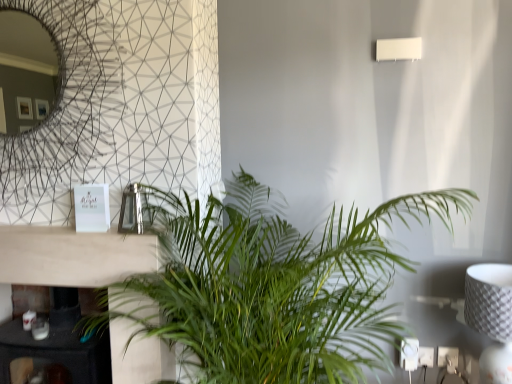
Question: From a real-world perspective, is green leafy plant at center physically located above or below black marble fireplace at lower left?

Choices:
 (A) above
 (B) below

Answer: (A)

Question: Does point coord(178,230) appear closer or farther from the camera than point coord(23,228)?

Choices:
 (A) farther
 (B) closer

Answer: (B)

Question: Considering the real-world distances, which object is farthest from the white matte rectangular lamp at upper right?

Choices:
 (A) black marble fireplace at lower left
 (B) white textured lampshade at right
 (C) green leafy plant at center

Answer: (A)

Question: Which object is the farthest from the white matte rectangular lamp at upper right?

Choices:
 (A) white textured lampshade at right
 (B) green leafy plant at center
 (C) black marble fireplace at lower left

Answer: (C)